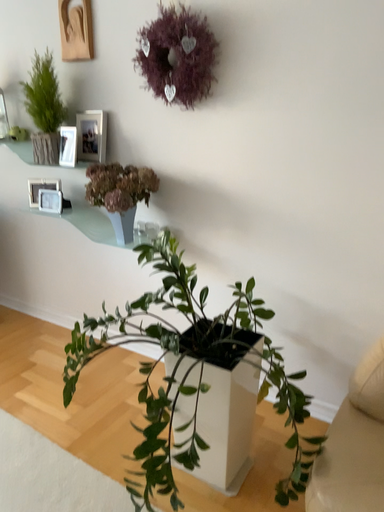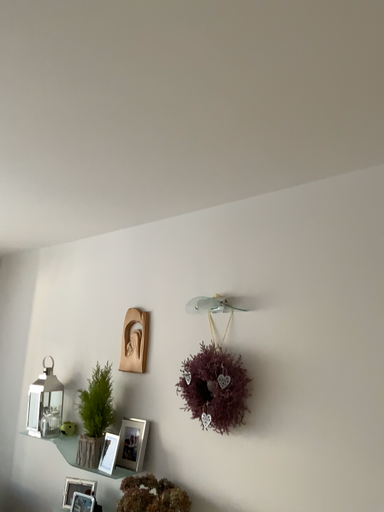
Question: How did the camera likely rotate when shooting the video?

Choices:
 (A) rotated downward
 (B) rotated upward

Answer: (B)